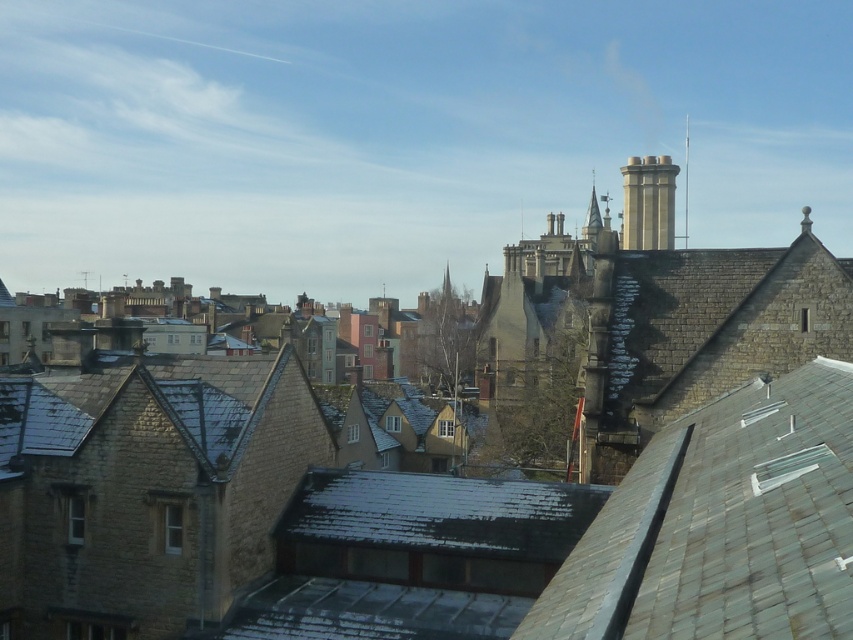
You are standing at the center of the image and looking towards the stone chimney at upper right located at point (648,202). Which direction should you turn to face the stone chimney at upper right?

You should turn to your right to face the stone chimney at upper right located at point (648,202).

You are an architect analyzing the historic urban landscape. You notice the stone chimney at upper right and the smooth stone spire at upper center. Which of these two structures is smaller in size?

The stone chimney at upper right is smaller in size compared to the smooth stone spire at upper center.